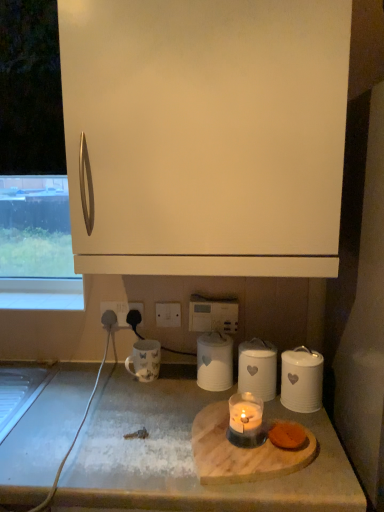
You are a GUI agent. You are given a task and a screenshot of the screen. Output one action in this format:
    pyautogui.click(x=<x>, y=<y>)
    Task: Click on the free point behind translucent glass candle at center
    This screenshot has height=512, width=384.
    Given the screenshot: What is the action you would take?
    pyautogui.click(x=213, y=400)